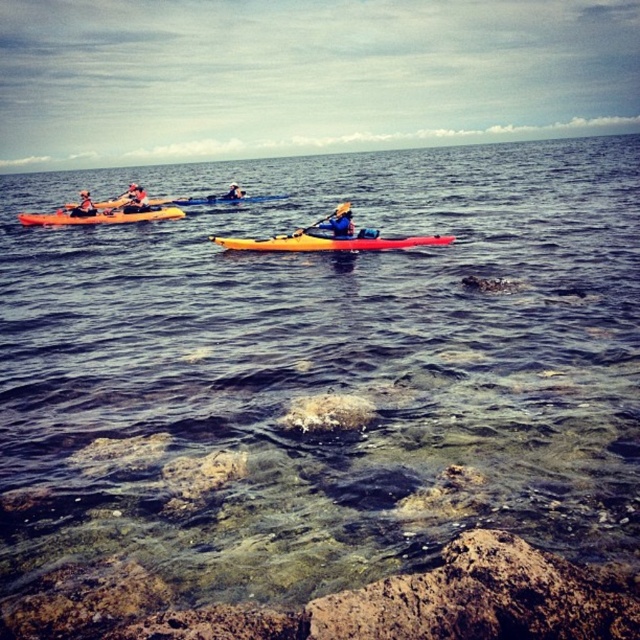
You are a photographer standing on the shore and want to capture both the clear water at center and the matte yellow kayak at center in your shot. Based on their positions, which object should you adjust your camera to focus on first to ensure both are in the frame?

The clear water at center is to the left of the matte yellow kayak at center, so you should focus on the matte yellow kayak at center first to ensure both are in the frame.

You are navigating a kayak in the serene waters shown in the image. You see an orange kayak at left. Based on its position coordinates, can you determine if it is closer to the foreground or the middle ground?

The orange kayak at left is positioned at coordinates point (100, 216). Since the middle ground is typically located between the foreground and background in an image, and given the coordinates provided, the orange kayak at left is likely situated in the middle ground rather than the foreground.